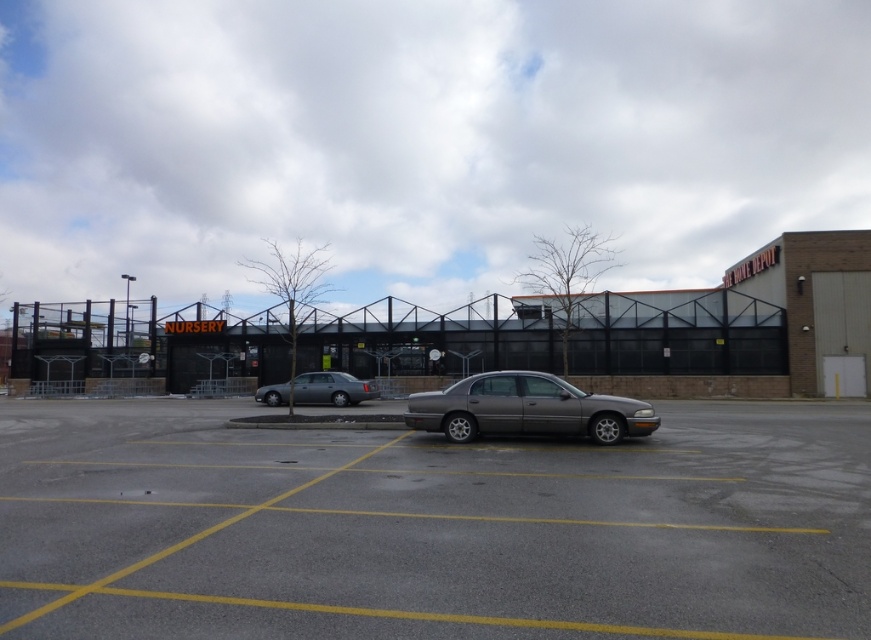
You are a delivery driver who needs to park your truck in the gray asphalt parking lot at center. Your truck is 10 feet wide. The satin silver sedan at center is currently parked there. Can the sedan be moved to another parking space to make room for your truck?

The gray asphalt parking lot at center has a larger size compared to satin silver sedan at center. Since the parking lot is bigger, there should be enough space to move the satin silver sedan at center to another parking space, allowing your truck to park there.

You are standing in the commercial area and want to walk from the point closer to you to the point further away. Which path should you take to go from the point at point (x=817, y=509) to the point at point (x=287, y=390)?

You should walk from the point at point (x=817, y=509) to the point at point (x=287, y=390) by moving forward since point (x=817, y=509) is closer to the viewer than point (x=287, y=390).

You are a delivery driver who needs to park your truck in the gray asphalt parking lot at center. However, there is a satin silver sedan at center already parked there. Based on the scene, can you safely park your truck in the parking lot without hitting the sedan?

The gray asphalt parking lot at center is in front of the satin silver sedan at center, meaning the sedan is parked behind the parking lot area. Since the parking lot is in front, you can safely park your truck there without hitting the sedan as it is positioned behind the parking space.